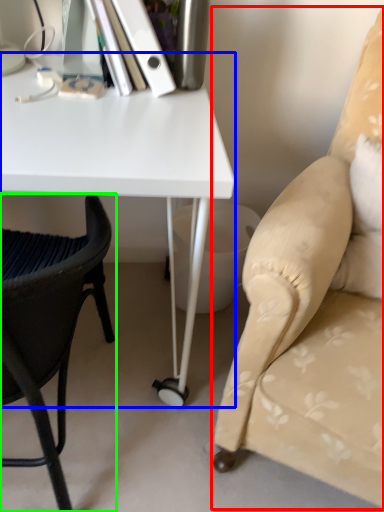
Question: Which object is positioned farthest from chair (highlighted by a red box)? Select from desk (highlighted by a blue box) and chair (highlighted by a green box).

Choices:
 (A) desk
 (B) chair

Answer: (B)